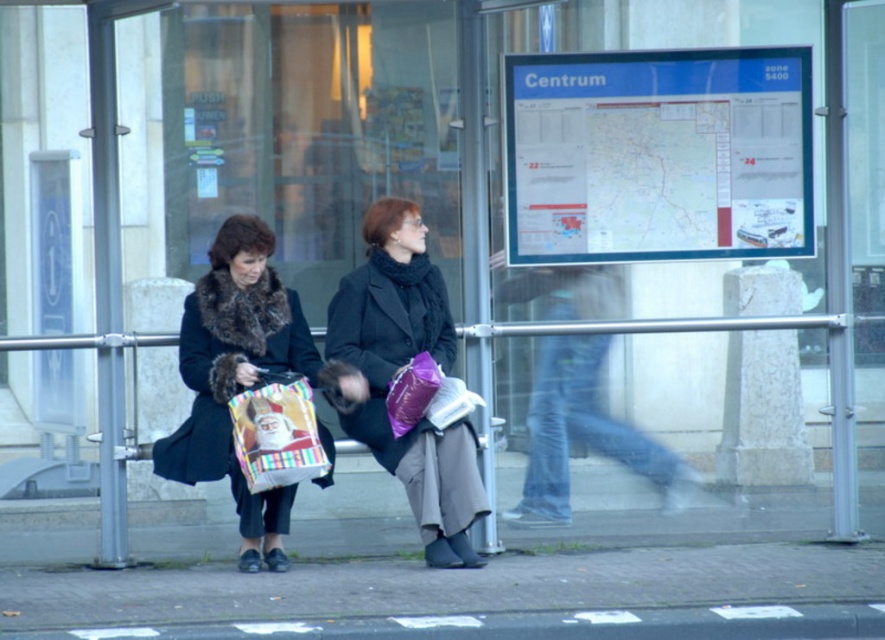
Does point (464, 499) come closer to viewer compared to point (387, 401)?

Yes, it is.

Locate an element on the screen. The image size is (885, 640). matte black coat at center is located at coordinates (399, 371).

What are the coordinates of `matte black coat at center` in the screenshot? It's located at (399, 371).

Can you confirm if velvet black coat at left is positioned to the right of matte plastic bag at center?

In fact, velvet black coat at left is to the left of matte plastic bag at center.

Which is more to the left, velvet black coat at left or matte plastic bag at center?

From the viewer's perspective, velvet black coat at left appears more on the left side.

Does point (268, 304) come closer to viewer compared to point (316, 458)?

No, (268, 304) is further to viewer.

Find the location of a particular element. velvet black coat at left is located at coordinates (240, 376).

Does matte plastic bag at center lie in front of purple matte bag at center?

Yes.

Who is more distant from viewer, (235,412) or (432,390)?

The point (235,412) is more distant.

Where is `matte plastic bag at center`? The image size is (885, 640). matte plastic bag at center is located at coordinates (276, 433).